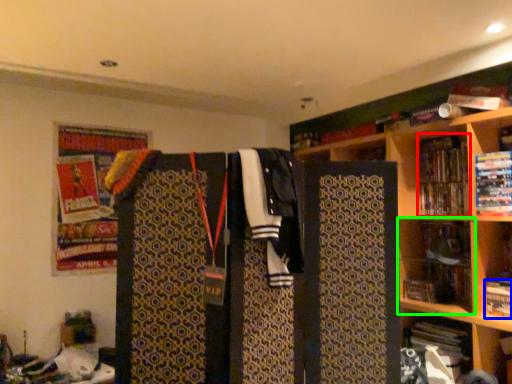
Question: Based on their relative distances, which object is farther from book (highlighted by a red box)? Choose from book (highlighted by a blue box) and shelf (highlighted by a green box).

Choices:
 (A) book
 (B) shelf

Answer: (A)